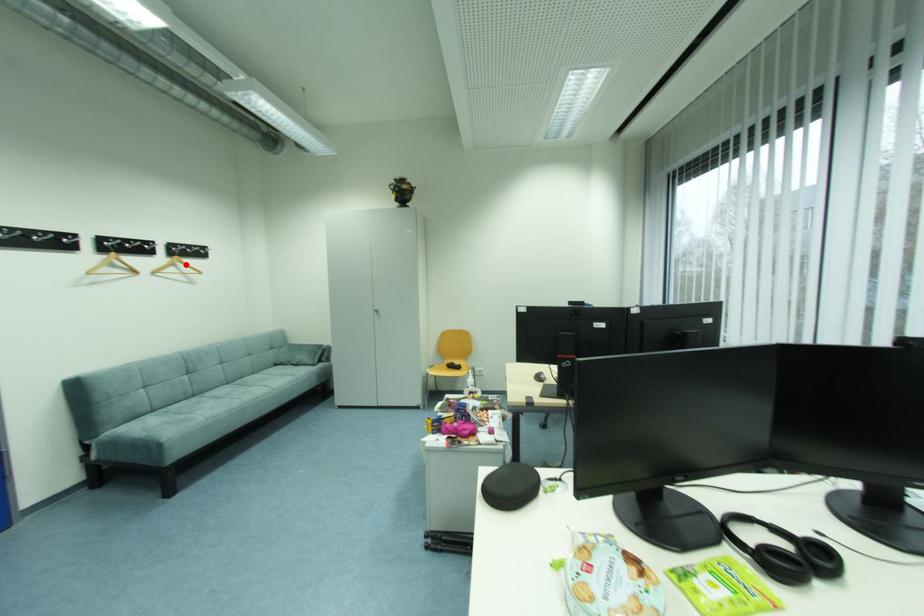
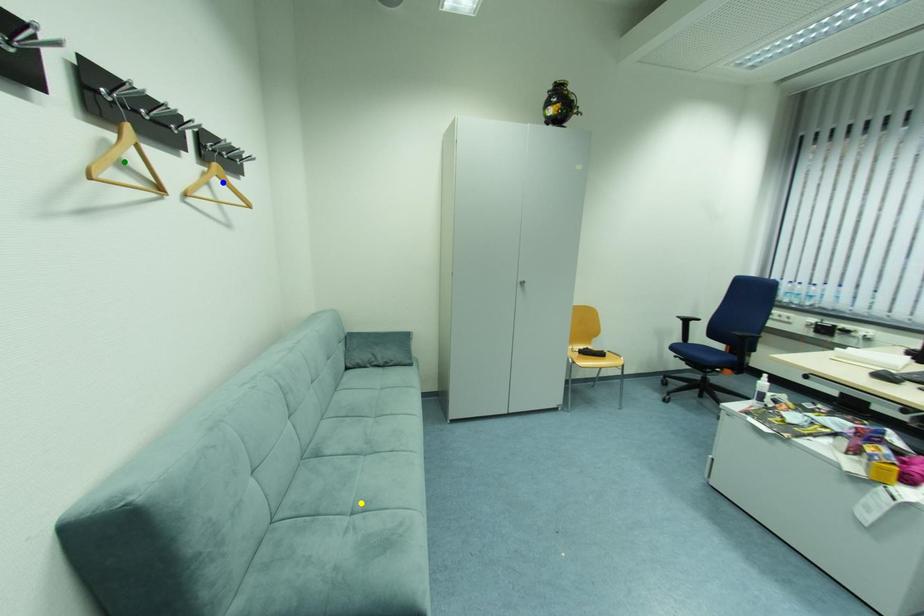
Question: I am providing you with two images of the same scene from different viewpoints. A red point is marked on the first image. You are given multiple points on the second image. Which point in image 2 represents the same 3d spot as the red point in image 1?

Choices:
 (A) blue point
 (B) yellow point
 (C) green point

Answer: (A)